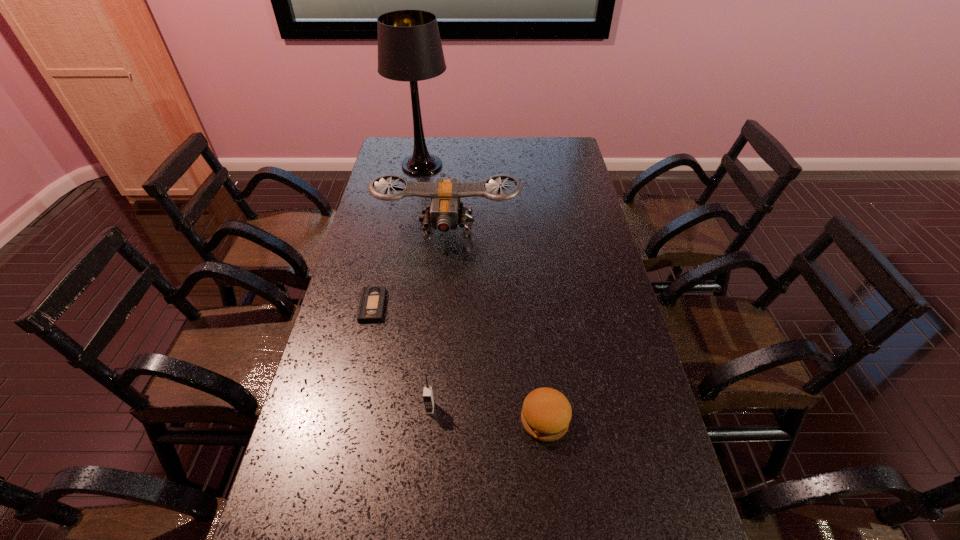
Image resolution: width=960 pixels, height=540 pixels. I want to click on free space located on the front-facing side of the cellular telephone, so click(425, 467).

You are a GUI agent. You are given a task and a screenshot of the screen. Output one action in this format:
    pyautogui.click(x=<x>, y=<y>)
    Task: Click on the vacant point located 0.110m on the front of the fourth tallest object
    The image size is (960, 540).
    Given the screenshot: What is the action you would take?
    pos(553,492)

Find the location of `free space located 0.260m on the right of the shortest object`. free space located 0.260m on the right of the shortest object is located at coordinates (470, 306).

Image resolution: width=960 pixels, height=540 pixels. Find the location of `object located in the far edge section of the desktop`. object located in the far edge section of the desktop is located at coordinates (409, 45).

Image resolution: width=960 pixels, height=540 pixels. Find the location of `table lamp that is at the left edge`. table lamp that is at the left edge is located at coordinates (409, 45).

This screenshot has width=960, height=540. Identify the location of drone that is positioned at the left edge. (443, 213).

Where is `videotape that is at the left edge`? The height and width of the screenshot is (540, 960). videotape that is at the left edge is located at coordinates (372, 302).

The width and height of the screenshot is (960, 540). I want to click on object that is positioned at the far left corner, so click(409, 45).

Where is `vacant point at the far edge`? The height and width of the screenshot is (540, 960). vacant point at the far edge is located at coordinates (450, 153).

This screenshot has width=960, height=540. In the image, there is a desktop. Find the location of `free space at the left edge`. free space at the left edge is located at coordinates (358, 339).